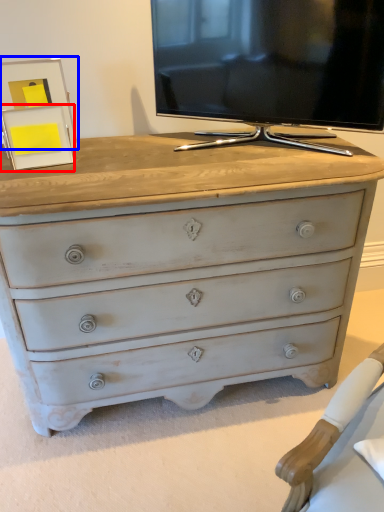
Question: Which of the following is the closest to the observer, picture frame (highlighted by a red box) or picture frame (highlighted by a blue box)?

Choices:
 (A) picture frame
 (B) picture frame

Answer: (A)